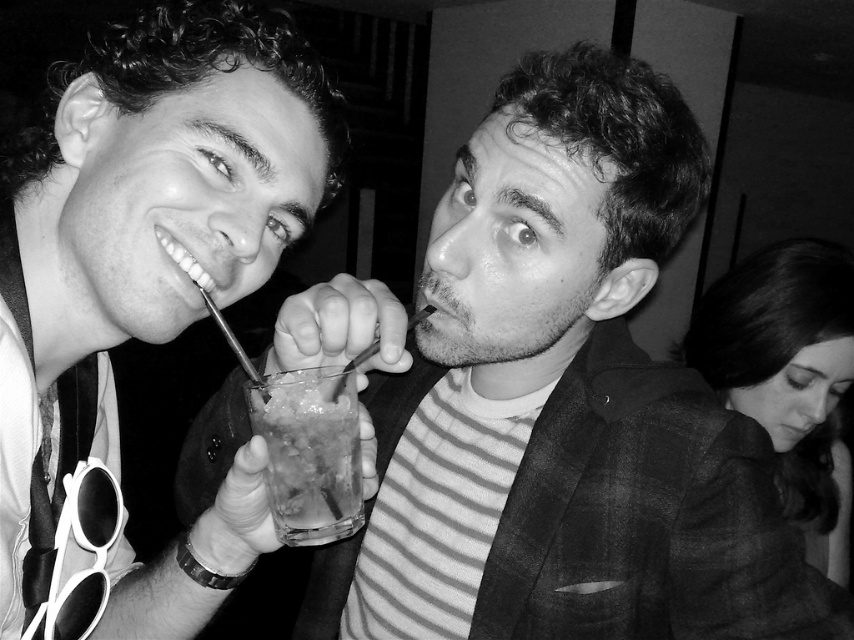
Does striped fabric shirt at center appear on the left side of translucent glass at center?

In fact, striped fabric shirt at center is to the right of translucent glass at center.

Does striped fabric shirt at center have a smaller size compared to translucent glass at center?

Actually, striped fabric shirt at center might be larger than translucent glass at center.

Locate an element on the screen. striped fabric shirt at center is located at coordinates (566, 403).

In the scene shown: Between matte black drink at center and translucent glass at center, which one is positioned higher?

matte black drink at center is higher up.

Is matte black drink at center behind translucent glass at center?

No, it is in front of translucent glass at center.

Find the location of a particular element. Image resolution: width=854 pixels, height=640 pixels. matte black drink at center is located at coordinates (148, 216).

Image resolution: width=854 pixels, height=640 pixels. I want to click on matte black drink at center, so click(148, 216).

Which is behind, point (531, 593) or point (68, 163)?

Point (531, 593)

At what (x,y) coordinates should I click in order to perform the action: click on striped fabric shirt at center. Please return your answer as a coordinate pair (x, y). Looking at the image, I should click on (566, 403).